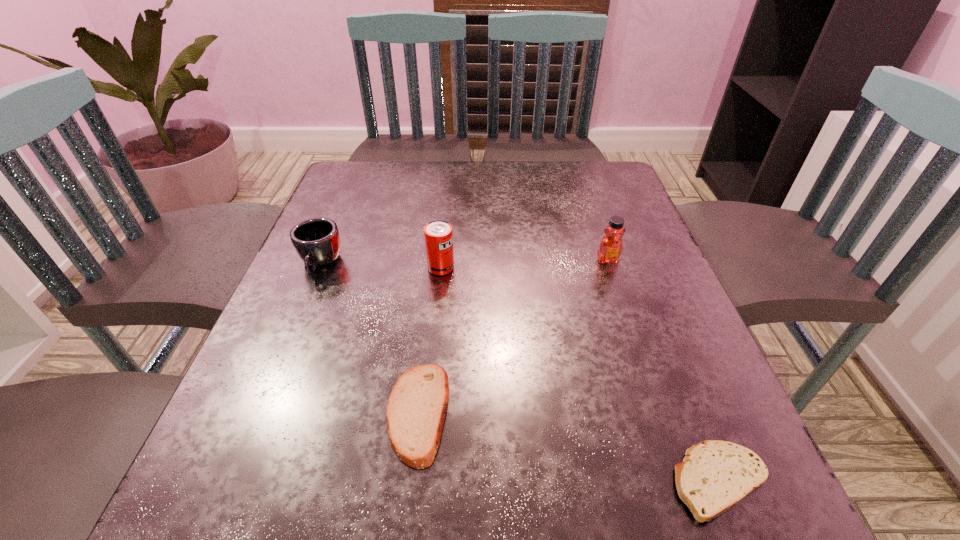
At what (x,y) coordinates should I click in order to perform the action: click on vacant space that satisfies the following two spatial constraints: 1. on the front label of the shorter pita bread; 2. on the left side of the honey. Please return your answer as a coordinate pair (x, y). Looking at the image, I should click on (682, 481).